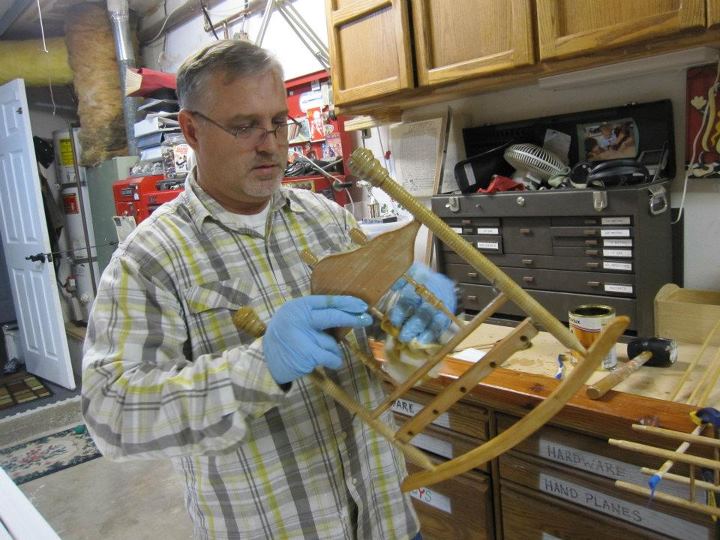
Find the location of a particular element. This screenshot has height=540, width=720. chair piece is located at coordinates (495, 357).